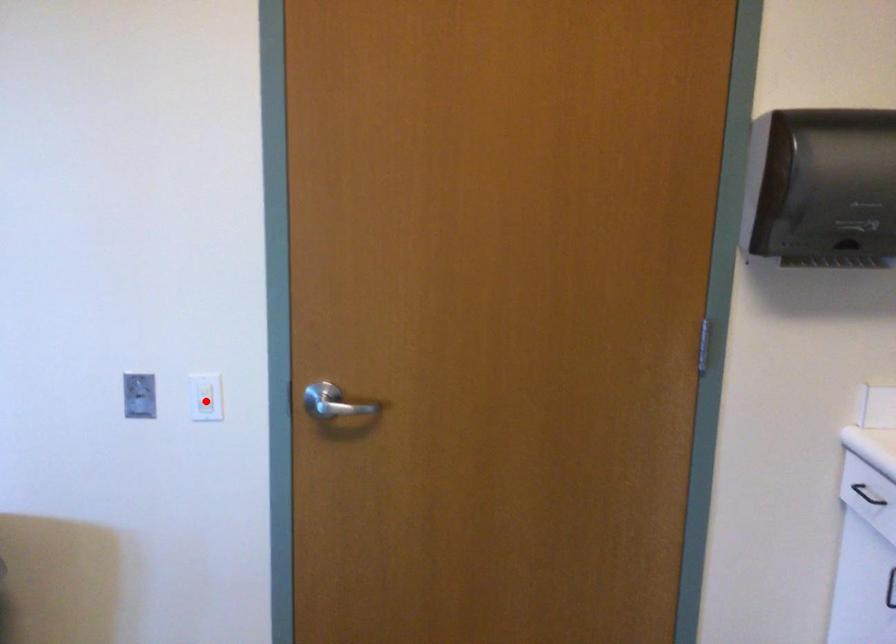
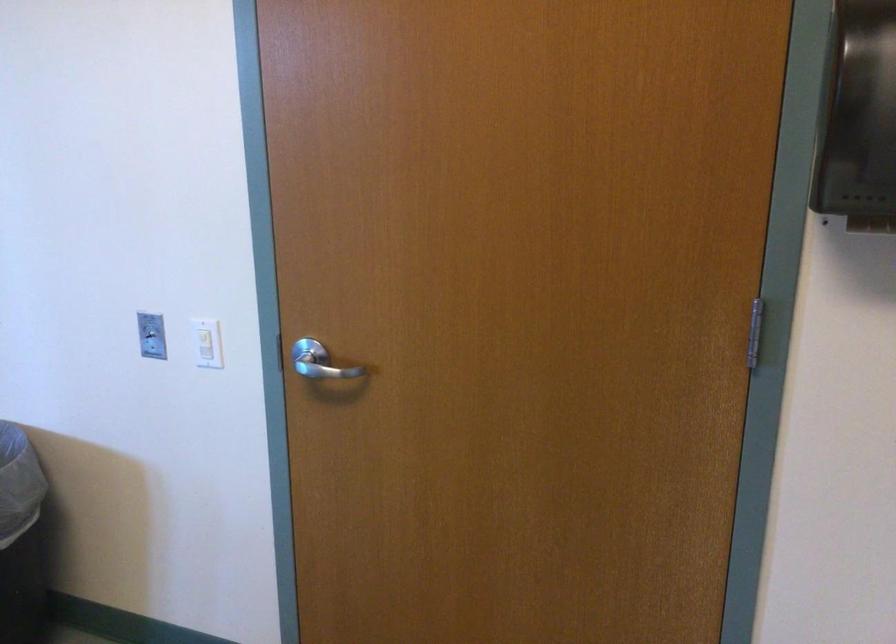
In the second image, find the point that corresponds to the highlighted location in the first image.

(205, 346)